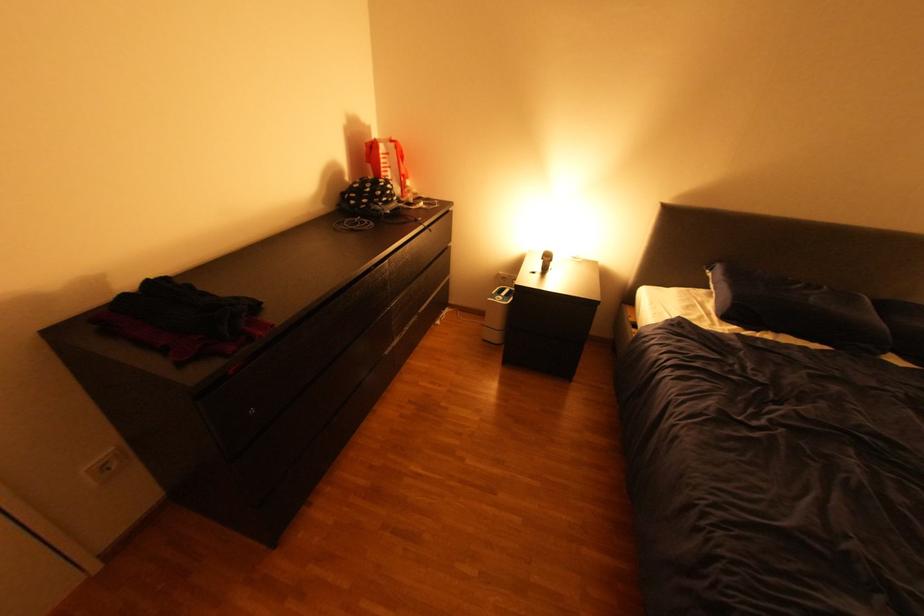
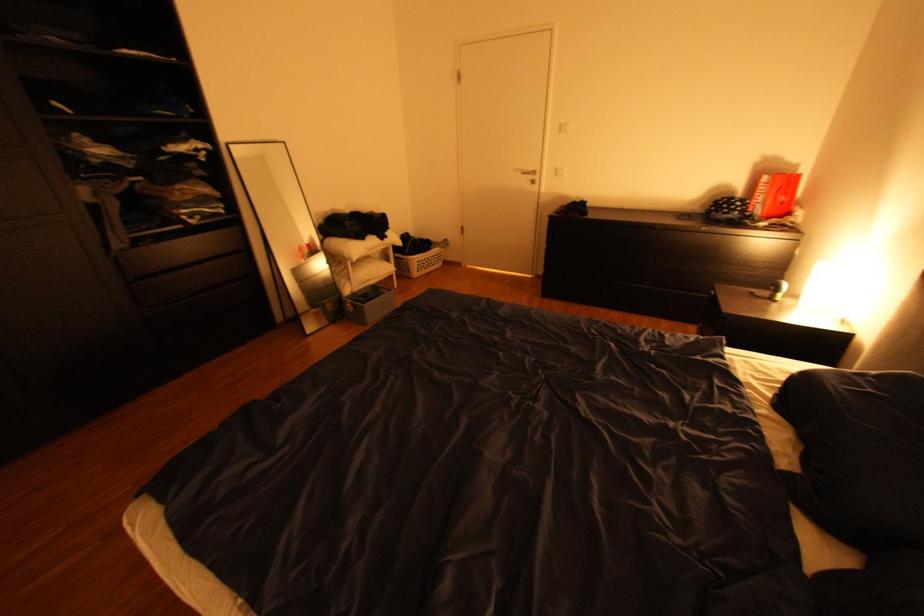
Locate, in the second image, the point that corresponds to the point at 106,568 in the first image.

(543, 276)